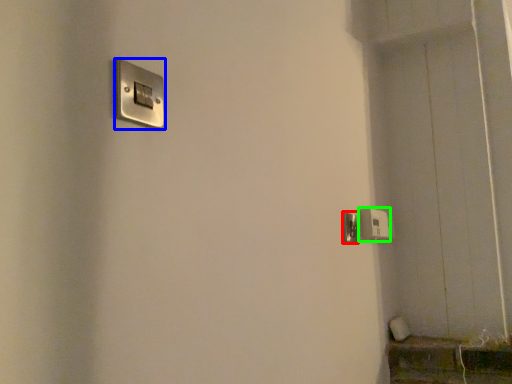
Question: Which object is positioned closest to door handle (highlighted by a red box)? Select from light switch (highlighted by a blue box) and light switch (highlighted by a green box).

Choices:
 (A) light switch
 (B) light switch

Answer: (B)